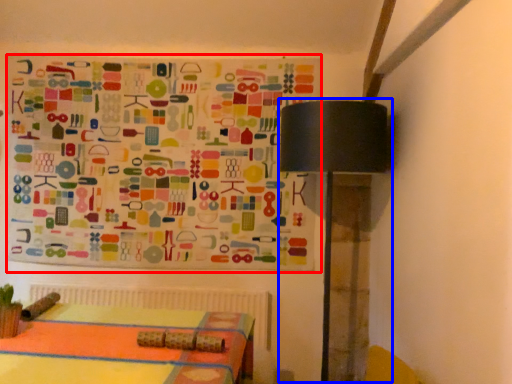
Question: Which point is further to the camera, bulletin board (highlighted by a red box) or table lamp (highlighted by a blue box)?

Choices:
 (A) bulletin board
 (B) table lamp

Answer: (A)